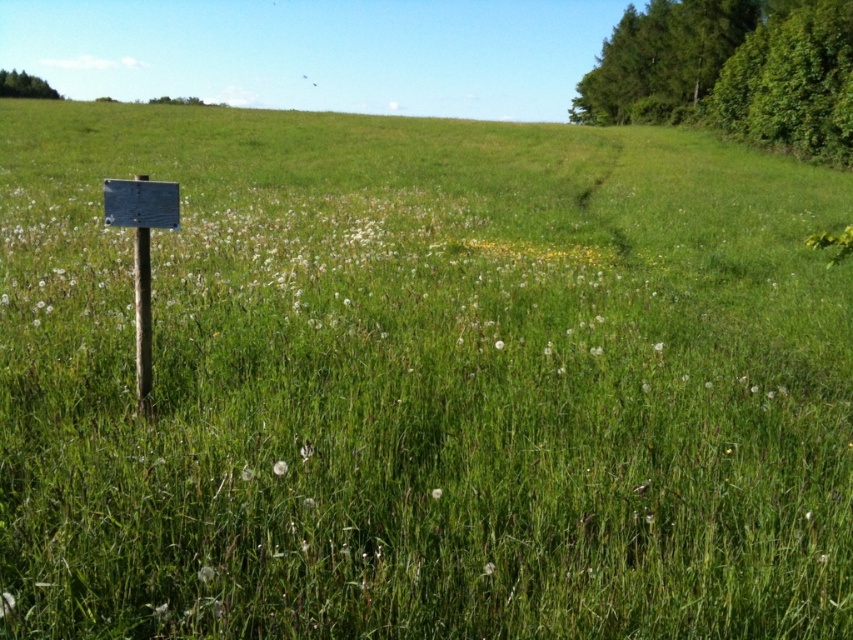
Question: Among these points, which one is nearest to the camera?

Choices:
 (A) (15, 77)
 (B) (659, 26)
 (C) (144, 355)

Answer: (C)

Question: Which point is closer to the camera taking this photo?

Choices:
 (A) (7, 83)
 (B) (146, 316)
 (C) (712, 96)

Answer: (B)

Question: Is green leafy tree at upper right above metallic signpost at left?

Choices:
 (A) yes
 (B) no

Answer: (A)

Question: Which point is closer to the camera taking this photo?

Choices:
 (A) (712, 17)
 (B) (136, 278)
 (C) (0, 96)

Answer: (B)

Question: Does metallic signpost at left have a larger size compared to green leafy tree at upper left?

Choices:
 (A) no
 (B) yes

Answer: (A)

Question: Does metallic signpost at left appear on the right side of green leafy tree at upper left?

Choices:
 (A) no
 (B) yes

Answer: (B)